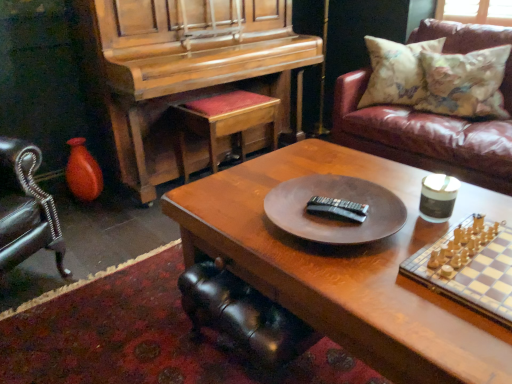
Question: Is polished wood piano at left inside or outside of wooden coffee table at center?

Choices:
 (A) outside
 (B) inside

Answer: (A)

Question: Is polished wood piano at left to the left or to the right of wooden coffee table at center in the image?

Choices:
 (A) right
 (B) left

Answer: (B)

Question: Estimate the real-world distances between objects in this image. Which object is farther from the wooden cushioned stool at center?

Choices:
 (A) black leather swivel chair at lower center
 (B) wooden chessboard at right
 (C) polished wood piano at left
 (D) floral fabric pillow at upper right, positioned as the 1th pillow in left-to-right order
 (E) floral fabric pillow at upper right, marked as the second pillow in a left-to-right arrangement

Answer: (B)

Question: Estimate the real-world distances between objects in this image. Which object is closer to the floral fabric pillow at upper right, positioned as the 1th pillow in left-to-right order?

Choices:
 (A) wooden coffee table at center
 (B) black leather swivel chair at lower center
 (C) floral fabric pillow at upper right, marked as the second pillow in a left-to-right arrangement
 (D) polished wood piano at left
 (E) leather couch at upper right

Answer: (C)